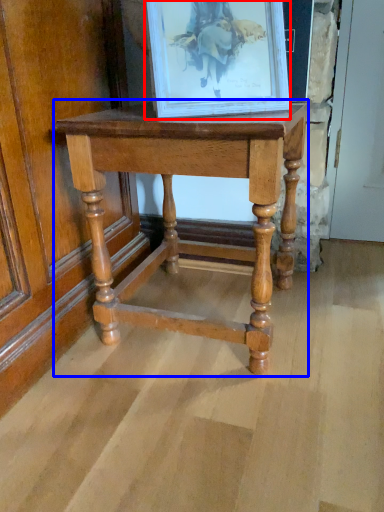
Question: Which point is further to the camera, picture frame (highlighted by a red box) or table (highlighted by a blue box)?

Choices:
 (A) picture frame
 (B) table

Answer: (B)